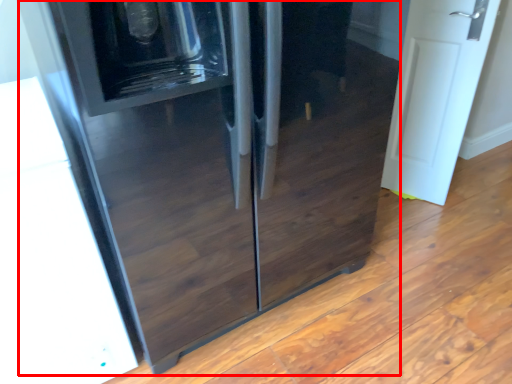
Question: Considering the relative positions of refrigerator (annotated by the red box) and door in the image provided, where is refrigerator (annotated by the red box) located with respect to the staircase?

Choices:
 (A) right
 (B) left

Answer: (B)